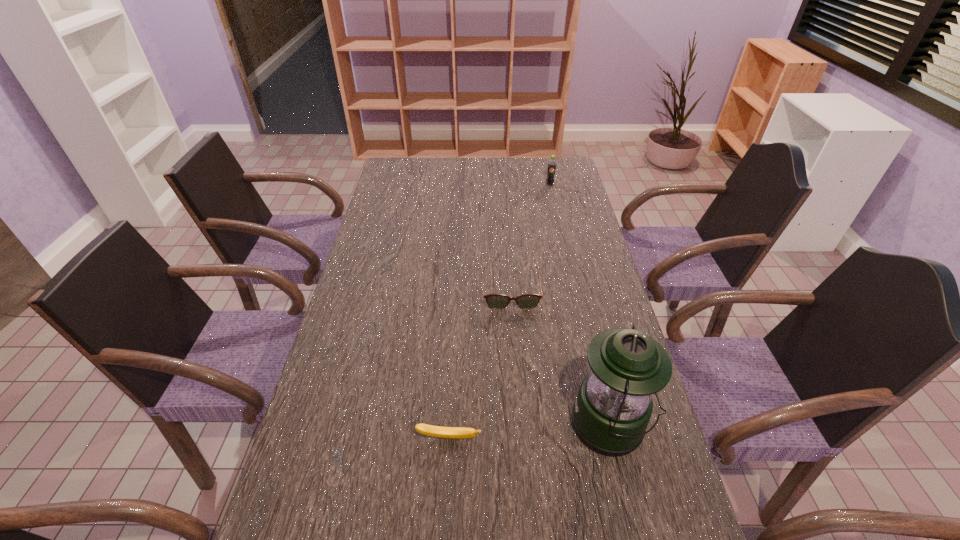
Find the location of a particular element. object at the far edge is located at coordinates (551, 169).

You are a GUI agent. You are given a task and a screenshot of the screen. Output one action in this format:
    pyautogui.click(x=<x>, y=<y>)
    Task: Click on the lantern situated at the right edge
    
    Given the screenshot: What is the action you would take?
    pyautogui.click(x=613, y=407)

Locate an element on the screen. soda that is at the right edge is located at coordinates (551, 169).

Where is `object positioned at the far right corner`? The image size is (960, 540). object positioned at the far right corner is located at coordinates (551, 169).

Find the location of a particular element. Image resolution: width=960 pixels, height=540 pixels. free location at the far edge of the desktop is located at coordinates (427, 158).

Where is `vacant space at the left edge`? This screenshot has height=540, width=960. vacant space at the left edge is located at coordinates (331, 409).

This screenshot has width=960, height=540. Identify the location of free space at the right edge of the desktop. (605, 302).

At what (x,y) coordinates should I click in order to perform the action: click on vacant region at the far left corner of the desktop. Please return your answer as a coordinate pair (x, y). This screenshot has height=540, width=960. Looking at the image, I should click on (422, 167).

Locate an element on the screen. The image size is (960, 540). empty location between the banana and the lantern is located at coordinates (530, 431).

At what (x,y) coordinates should I click in order to perform the action: click on unoccupied position between the spectacles and the banana. Please return your answer as a coordinate pair (x, y). This screenshot has height=540, width=960. Looking at the image, I should click on (480, 365).